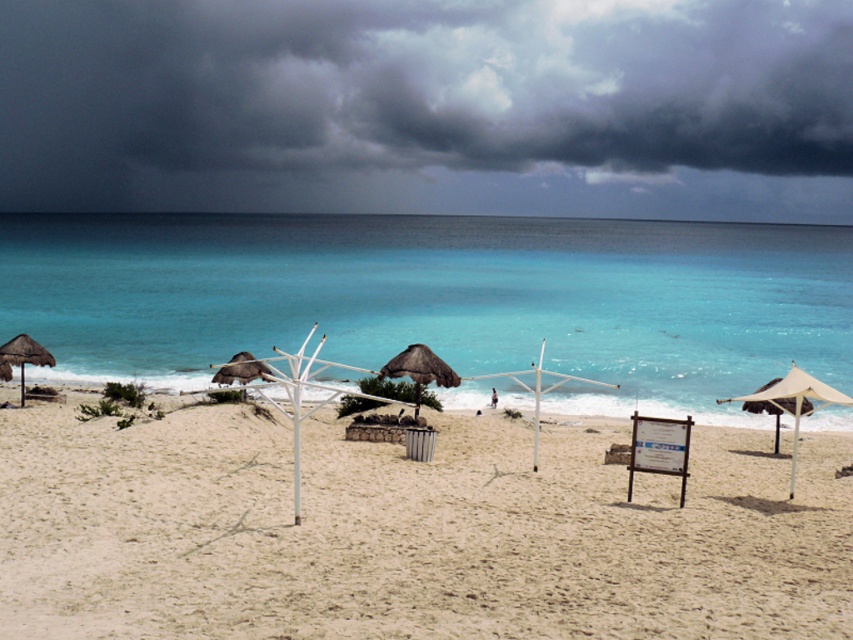
Question: Can you confirm if light beige sand at center is thinner than beige canvas umbrella at right?

Choices:
 (A) yes
 (B) no

Answer: (B)

Question: Is the position of beige canvas umbrella at right less distant than that of thatched straw umbrella at center?

Choices:
 (A) yes
 (B) no

Answer: (A)

Question: Which point is closer to the camera?

Choices:
 (A) (94, 435)
 (B) (6, 369)
 (C) (747, 406)
 (D) (729, 129)

Answer: (A)

Question: Among these points, which one is farthest from the camera?

Choices:
 (A) (421, 467)
 (B) (7, 352)
 (C) (763, 387)
 (D) (764, 394)

Answer: (B)

Question: Can you confirm if dark gray cloud at upper center is wider than light beige sand at center?

Choices:
 (A) no
 (B) yes

Answer: (B)

Question: Which point appears closest to the camera in this image?

Choices:
 (A) (24, 337)
 (B) (788, 400)

Answer: (B)